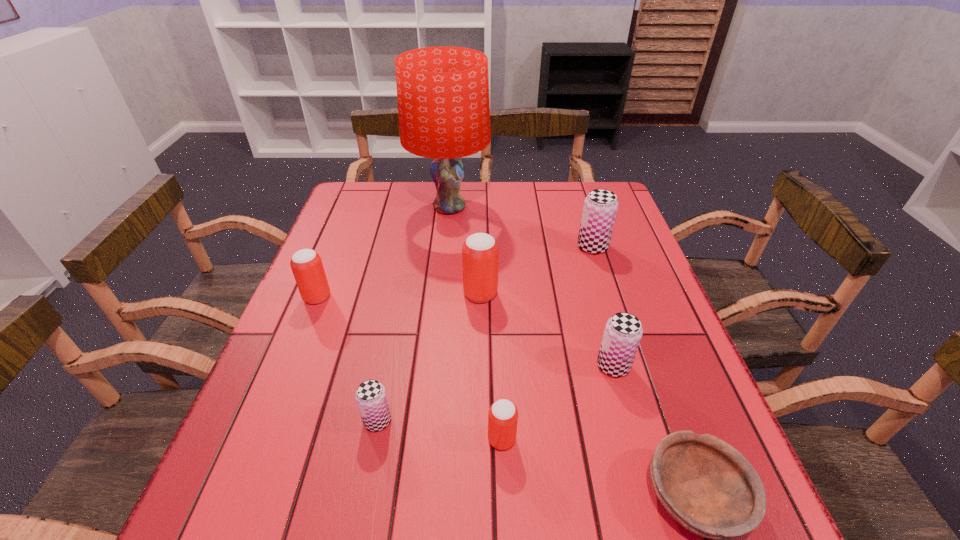
You are a GUI agent. You are given a task and a screenshot of the screen. Output one action in this format:
    pyautogui.click(x=<x>, y=<y>)
    Task: Click on the leftmost purple beer can
    The width and height of the screenshot is (960, 540).
    Given the screenshot: What is the action you would take?
    coord(371,398)

Identify the location of the smallest red beer can. (503, 415).

At what (x,y) coordinates should I click in order to perform the action: click on vacant area situated on the front-facing side of the tallest object. Please return your answer as a coordinate pair (x, y). This screenshot has height=540, width=960. Looking at the image, I should click on (444, 261).

Locate an element on the screen. This screenshot has height=540, width=960. free region located 0.240m on the left of the farthest beer can is located at coordinates (492, 247).

Where is `free spot located 0.290m on the right of the biggest red beer can`? free spot located 0.290m on the right of the biggest red beer can is located at coordinates pyautogui.click(x=613, y=294).

At what (x,y) coordinates should I click in order to perform the action: click on vacant space located 0.370m on the left of the second smallest purple beer can. Please return your answer as a coordinate pair (x, y). The image size is (960, 540). Looking at the image, I should click on (421, 366).

Image resolution: width=960 pixels, height=540 pixels. In order to click on free space located on the back of the second biggest red beer can in this screenshot , I will do `click(332, 260)`.

The height and width of the screenshot is (540, 960). What are the coordinates of `free location located 0.150m on the left of the nearest purple beer can` in the screenshot? It's located at pos(284,421).

Find the location of a particular element. blank space located on the right of the nearest red beer can is located at coordinates (543, 440).

I want to click on object at the far edge, so click(443, 92).